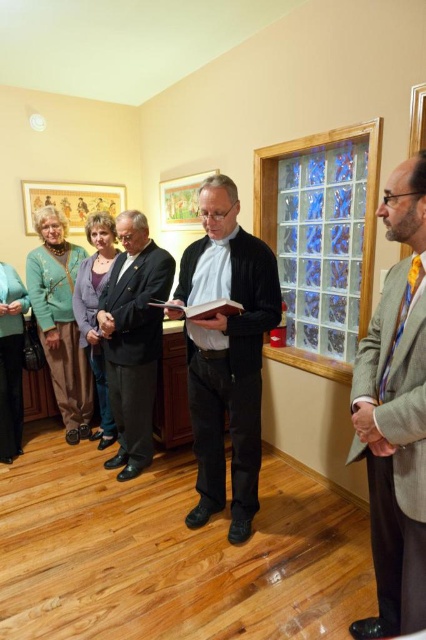
Is gray wool suit at right above matte green sweater at left?

No, gray wool suit at right is not above matte green sweater at left.

Which is behind, point (405, 627) or point (46, 276)?

The point (46, 276) is more distant.

Identify the location of gray wool suit at right. The height and width of the screenshot is (640, 426). (396, 413).

Is point (192, 372) positioned after point (19, 372)?

No, it is not.

Who is lower down, black matte sweater at center or teal fabric scarf at left?

teal fabric scarf at left

Where is `black matte sweater at center`? black matte sweater at center is located at coordinates [x=227, y=353].

Which is behind, point (374, 353) or point (149, 236)?

The point (149, 236) is more distant.

At what (x,y) coordinates should I click in order to perform the action: click on gray wool suit at right. Please return your answer as a coordinate pair (x, y). Looking at the image, I should click on (396, 413).

This screenshot has height=640, width=426. What are the coordinates of `gray wool suit at right` in the screenshot? It's located at (396, 413).